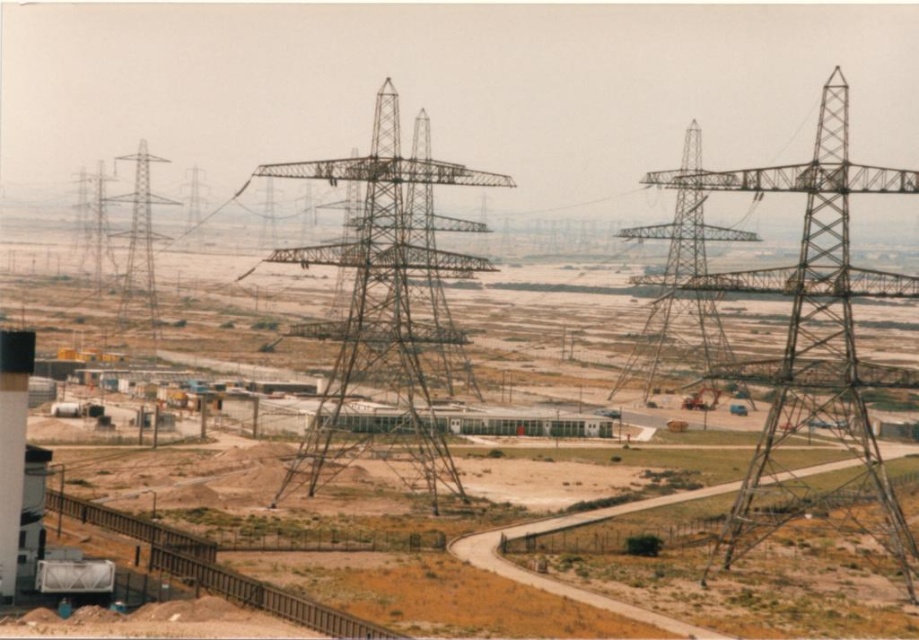
Question: Which object is the farthest from the green metallic tower at center?

Choices:
 (A) metallic structure at center
 (B) metallic structure at center-right

Answer: (A)

Question: Which object is farther from the camera taking this photo?

Choices:
 (A) metallic structure at center-right
 (B) green metallic tower at center

Answer: (A)

Question: Estimate the real-world distances between objects in this image. Which object is farther from the metallic gray tower at left?

Choices:
 (A) metallic structure at center
 (B) metallic train track at lower left
 (C) green metallic tower at center
 (D) metallic structure at center-right

Answer: (A)

Question: Is green metallic tower at center thinner than metallic gray tower at left?

Choices:
 (A) yes
 (B) no

Answer: (B)

Question: Is the position of metallic structure at center more distant than that of green metallic tower at center?

Choices:
 (A) no
 (B) yes

Answer: (A)

Question: Is metallic structure at center-right above metallic train track at lower left?

Choices:
 (A) yes
 (B) no

Answer: (A)